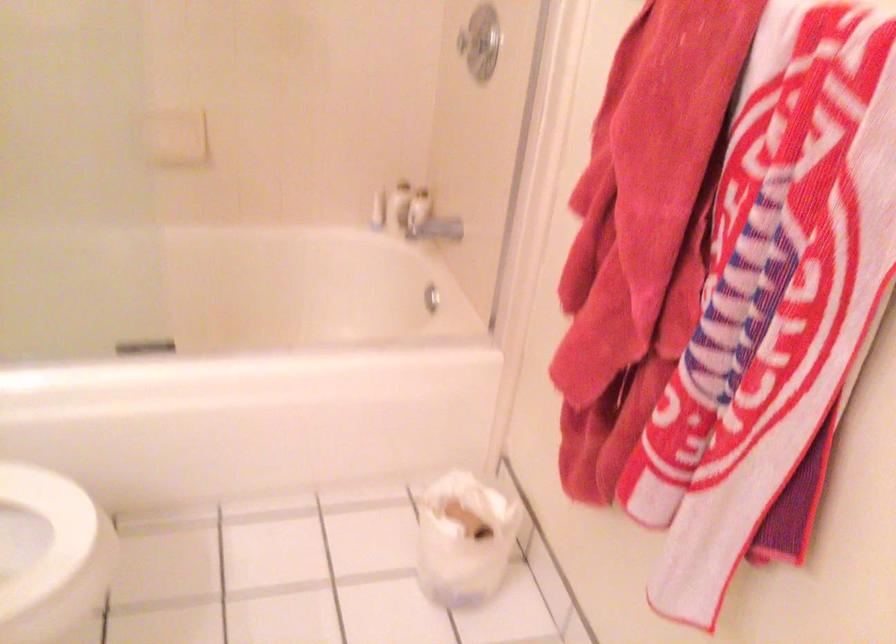
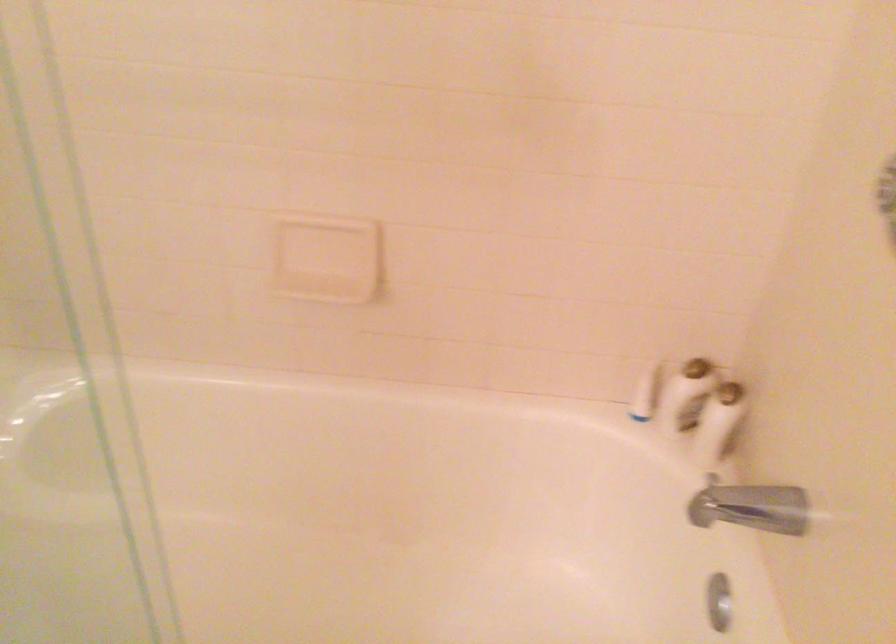
The point at [433,292] is marked in the first image. Where is the corresponding point in the second image?

(719, 601)